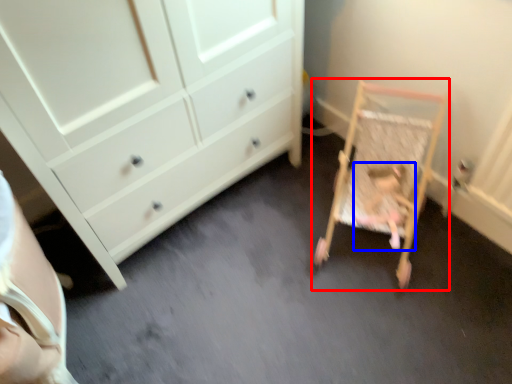
Question: Which point is further to the camera, furniture (highlighted by a red box) or person (highlighted by a blue box)?

Choices:
 (A) furniture
 (B) person

Answer: (B)